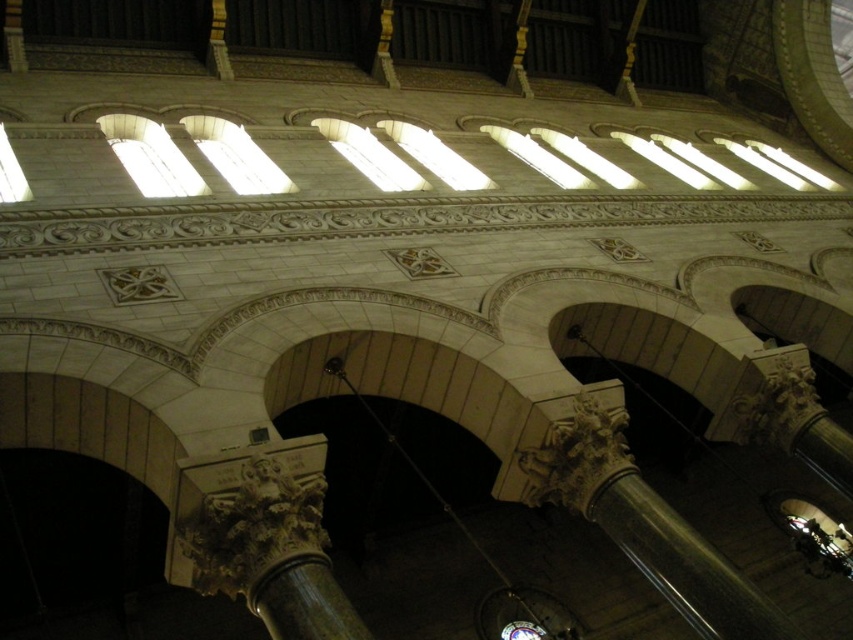
You are an architect analyzing the structural integrity of the cathedral. Given that the carved stone column at center and the clear glass window at upper left are both critical elements, which one might require more reinforcement based on their relative heights?

The carved stone column at center has a greater height compared to the clear glass window at upper left, so it might require more reinforcement due to its taller structure.

You are an architect examining the cathedral ceiling. You notice the carved stone column at center and the white glass window at upper center. Which object is positioned to the right of the other?

The carved stone column at center is to the right of the white glass window at upper center.

Looking at this image, you are an architect examining the cathedral ceiling. You notice the white glass window at upper center and the clear glass window at upper left. Which window is closer to your viewpoint?

The white glass window at upper center is closer to the viewpoint since it is further to the viewer than the clear glass window at upper left.